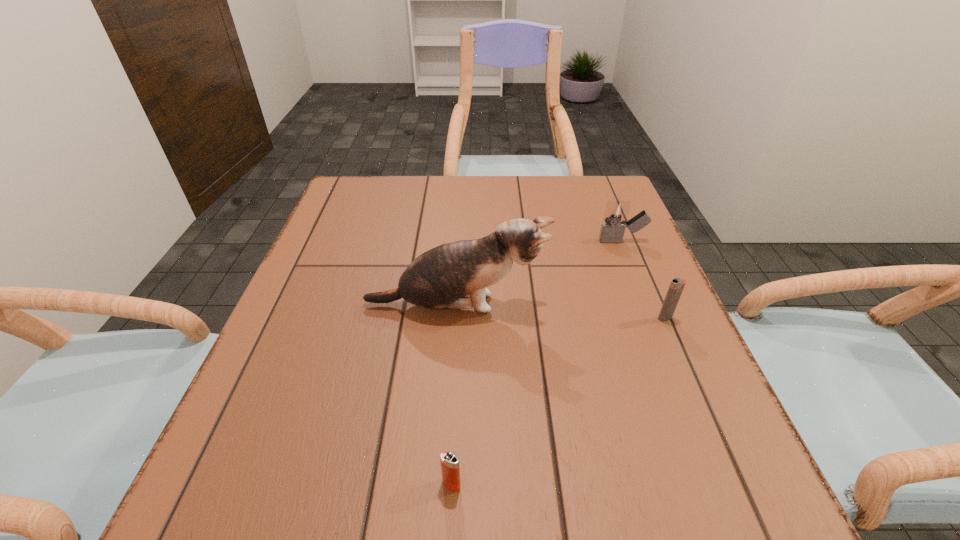
Identify which igniter is located as the third nearest to the cat. Please provide its 2D coordinates. Your answer should be formatted as a tuple, i.e. [(x, y)], where the tuple contains the x and y coordinates of a point satisfying the conditions above.

[(449, 461)]

Locate an element on the screen. Image resolution: width=960 pixels, height=540 pixels. vacant area in the image that satisfies the following two spatial constraints: 1. at the face of the leftmost igniter; 2. on the left side of the cat is located at coordinates (444, 484).

You are a GUI agent. You are given a task and a screenshot of the screen. Output one action in this format:
    pyautogui.click(x=<x>, y=<y>)
    Task: Click on the free space that satisfies the following two spatial constraints: 1. on the front side of the second farthest igniter; 2. on the left side of the farthest igniter
    
    Given the screenshot: What is the action you would take?
    pyautogui.click(x=653, y=318)

You are a GUI agent. You are given a task and a screenshot of the screen. Output one action in this format:
    pyautogui.click(x=<x>, y=<y>)
    Task: Click on the free space that satisfies the following two spatial constraints: 1. on the back side of the shortest igniter; 2. on the left side of the farthest igniter
    The width and height of the screenshot is (960, 540).
    Given the screenshot: What is the action you would take?
    point(464,241)

This screenshot has width=960, height=540. Identify the location of blank space that satisfies the following two spatial constraints: 1. at the face of the nearest igniter; 2. on the right side of the tallest object. (444, 484).

Identify the location of vacant space that satisfies the following two spatial constraints: 1. at the face of the tallest object; 2. on the left side of the second farthest igniter. The height and width of the screenshot is (540, 960). (455, 318).